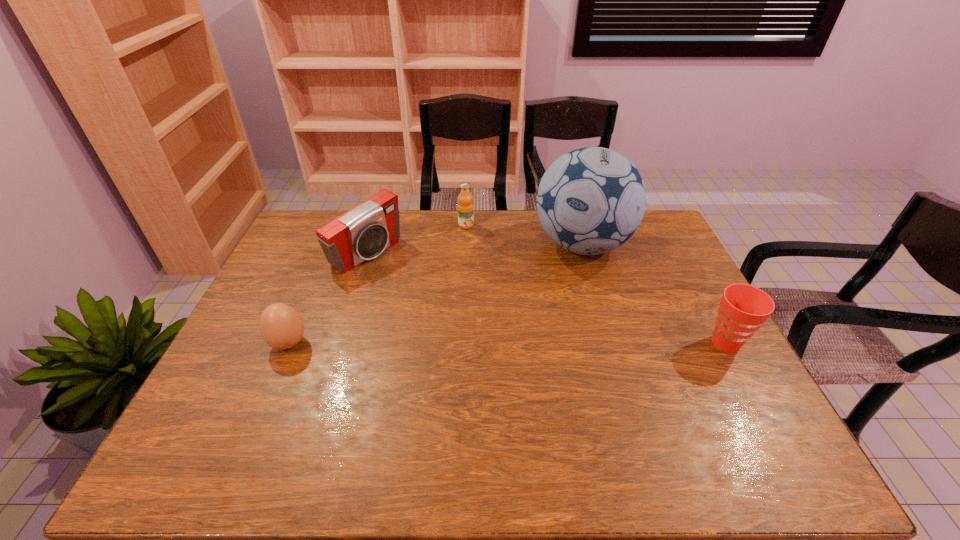
The height and width of the screenshot is (540, 960). Find the location of `free space on the desktop that is between the boiled egg and the rightmost object and is positioned on the front-facing side of the camera`. free space on the desktop that is between the boiled egg and the rightmost object and is positioned on the front-facing side of the camera is located at coordinates (497, 343).

Where is `free space on the desktop that is between the boiled egg and the rightmost object and is positioned on the side with brand of the soccer ball`? The image size is (960, 540). free space on the desktop that is between the boiled egg and the rightmost object and is positioned on the side with brand of the soccer ball is located at coordinates tap(565, 343).

Find the location of a particular element. free spot on the desktop that is between the shortest object and the rightmost object and is positioned on the label of the third object from left to right is located at coordinates (558, 343).